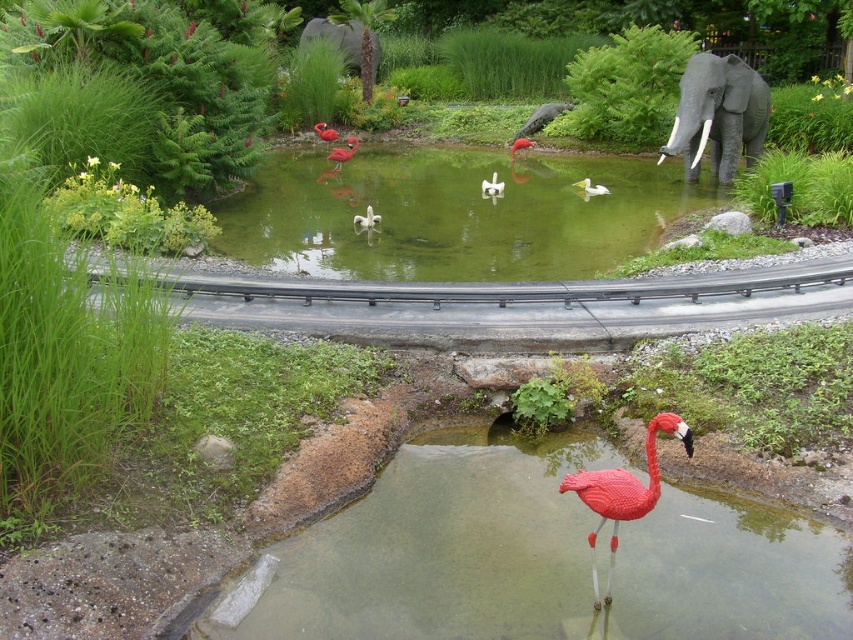
Question: Based on their relative distances, which object is farther from the white glossy bird at center?

Choices:
 (A) matte pink flamingo at center
 (B) matte plastic flamingo at center

Answer: (A)

Question: Can you confirm if green matte water at center is smaller than matte pink flamingo at center?

Choices:
 (A) yes
 (B) no

Answer: (B)

Question: Which point is farther to the camera?

Choices:
 (A) matte plastic flamingo at center
 (B) white matte duck at center
 (C) matte pink flamingo at center
 (D) white glossy bird at center

Answer: (C)

Question: Which point is farther to the camera?

Choices:
 (A) (514, 140)
 (B) (749, 88)
 (C) (635, 515)

Answer: (A)

Question: Is transparent plastic water at lower center to the left of gray matte elephant at upper right from the viewer's perspective?

Choices:
 (A) no
 (B) yes

Answer: (B)

Question: Does green matte water at center lie in front of white matte duck at center?

Choices:
 (A) no
 (B) yes

Answer: (B)